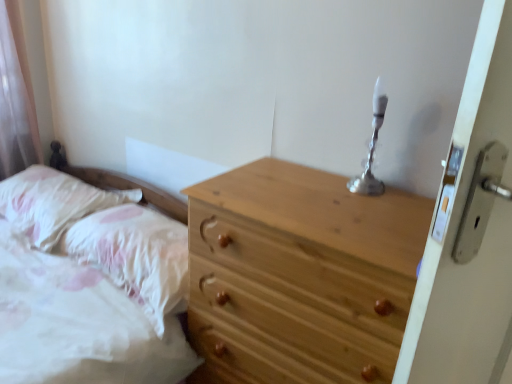
Question: From the image's perspective, does fluffy white pillow at left, the first pillow from the left, appear higher than silver metallic candle holder at upper right?

Choices:
 (A) no
 (B) yes

Answer: (A)

Question: Does fluffy white pillow at left, which ranks as the second pillow in right-to-left order, have a lesser width compared to silver metallic candle holder at upper right?

Choices:
 (A) no
 (B) yes

Answer: (A)

Question: From a real-world perspective, is fluffy white pillow at left, which ranks as the second pillow in right-to-left order, physically below silver metallic candle holder at upper right?

Choices:
 (A) no
 (B) yes

Answer: (B)

Question: Considering the relative sizes of fluffy white pillow at left, which ranks as the second pillow in right-to-left order, and silver metallic candle holder at upper right in the image provided, is fluffy white pillow at left, which ranks as the second pillow in right-to-left order, wider than silver metallic candle holder at upper right?

Choices:
 (A) yes
 (B) no

Answer: (A)

Question: Is fluffy white pillow at left, the first pillow from the left, closer to camera compared to silver metallic candle holder at upper right?

Choices:
 (A) yes
 (B) no

Answer: (B)

Question: Considering the relative sizes of fluffy white pillow at left, the first pillow from the left, and silver metallic candle holder at upper right in the image provided, is fluffy white pillow at left, the first pillow from the left, smaller than silver metallic candle holder at upper right?

Choices:
 (A) yes
 (B) no

Answer: (B)

Question: Considering the relative sizes of white fluffy pillow at lower left, arranged as the 2th pillow when viewed from the left, and fluffy white pillow at left, which ranks as the second pillow in right-to-left order, in the image provided, is white fluffy pillow at lower left, arranged as the 2th pillow when viewed from the left, shorter than fluffy white pillow at left, which ranks as the second pillow in right-to-left order,?

Choices:
 (A) yes
 (B) no

Answer: (B)

Question: Is white fluffy pillow at lower left, arranged as the 2th pillow when viewed from the left, facing towards fluffy white pillow at left, the first pillow from the left?

Choices:
 (A) yes
 (B) no

Answer: (B)

Question: Can you confirm if white fluffy pillow at lower left, arranged as the 2th pillow when viewed from the left, is wider than fluffy white pillow at left, the first pillow from the left?

Choices:
 (A) yes
 (B) no

Answer: (A)

Question: Can you confirm if white fluffy pillow at lower left, arranged as the 2th pillow when viewed from the left, is positioned to the right of fluffy white pillow at left, which ranks as the second pillow in right-to-left order?

Choices:
 (A) yes
 (B) no

Answer: (A)

Question: From a real-world perspective, is white fluffy pillow at lower left, arranged as the 2th pillow when viewed from the left, beneath fluffy white pillow at left, the first pillow from the left?

Choices:
 (A) no
 (B) yes

Answer: (B)

Question: Does white fluffy pillow at lower left, the 1th pillow positioned from the right, lie behind fluffy white pillow at left, which ranks as the second pillow in right-to-left order?

Choices:
 (A) yes
 (B) no

Answer: (B)

Question: Is silver metallic candle holder at upper right not close to natural wood chest of drawers at center?

Choices:
 (A) yes
 (B) no

Answer: (B)